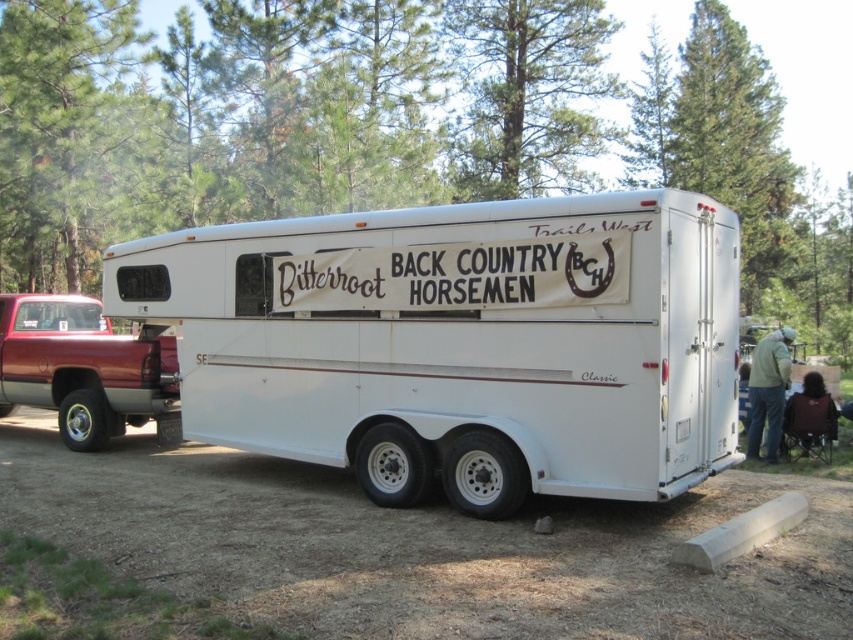
Based on the photo, you are standing in front of the white matte horse trailer at center and want to sit down. There is a dark brown fabric chair at lower right nearby. Which direction should you move to reach the chair?

The dark brown fabric chair at lower right is located below the white matte horse trailer at center, so you should move downward to reach it.

You are a photographer setting up equipment in the forest. You have a white matte horse trailer at center and a dark brown fabric chair at lower right in your shot. Which object is closer to the camera?

The white matte horse trailer at center is closer to the camera because it is in front of the dark brown fabric chair at lower right.